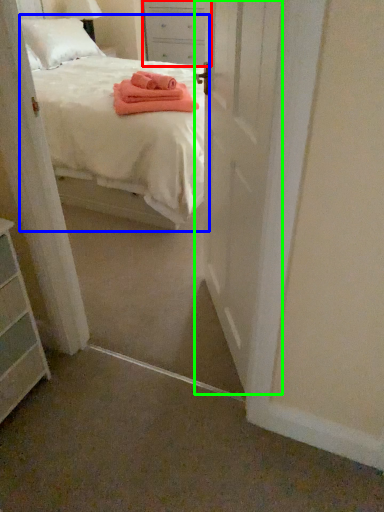
Question: Which object is the closest to the nightstand (highlighted by a red box)? Choose among these: bed (highlighted by a blue box) or door (highlighted by a green box).

Choices:
 (A) bed
 (B) door

Answer: (A)